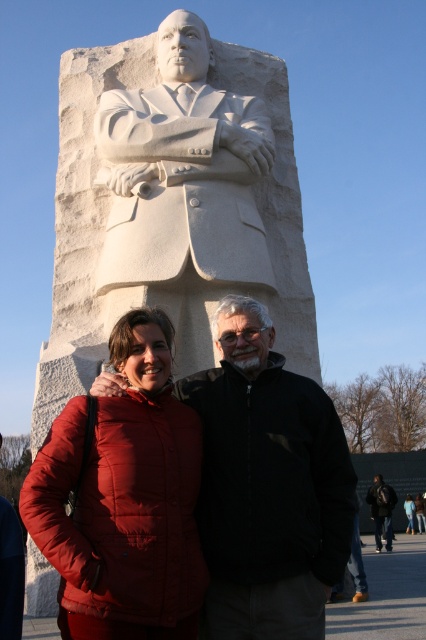
Between point (385, 508) and point (409, 493), which one is positioned behind?

The point (409, 493) is more distant.

Which of these two, dark blue jeans at lower right or red puffer jacket at center, stands shorter?

red puffer jacket at center

In order to click on dark blue jeans at lower right in this screenshot , I will do `click(382, 509)`.

The image size is (426, 640). In order to click on dark blue jeans at lower right in this screenshot , I will do `click(382, 509)`.

Which is behind, point (152, 456) or point (409, 516)?

The point (409, 516) is behind.

Can you confirm if matte red jacket at lower left is positioned to the right of red puffer jacket at center?

Incorrect, matte red jacket at lower left is not on the right side of red puffer jacket at center.

What are the coordinates of `matte red jacket at lower left` in the screenshot? It's located at (123, 499).

Does white marble statue at center have a lesser width compared to dark blue jeans at lower right?

Incorrect, white marble statue at center's width is not less than dark blue jeans at lower right's.

Who is lower down, white marble statue at center or dark blue jeans at lower right?

dark blue jeans at lower right is lower down.

Who is more distant from viewer, (141, 83) or (385, 532)?

Point (385, 532)

Where is `white marble statue at center`? This screenshot has width=426, height=640. white marble statue at center is located at coordinates (169, 211).